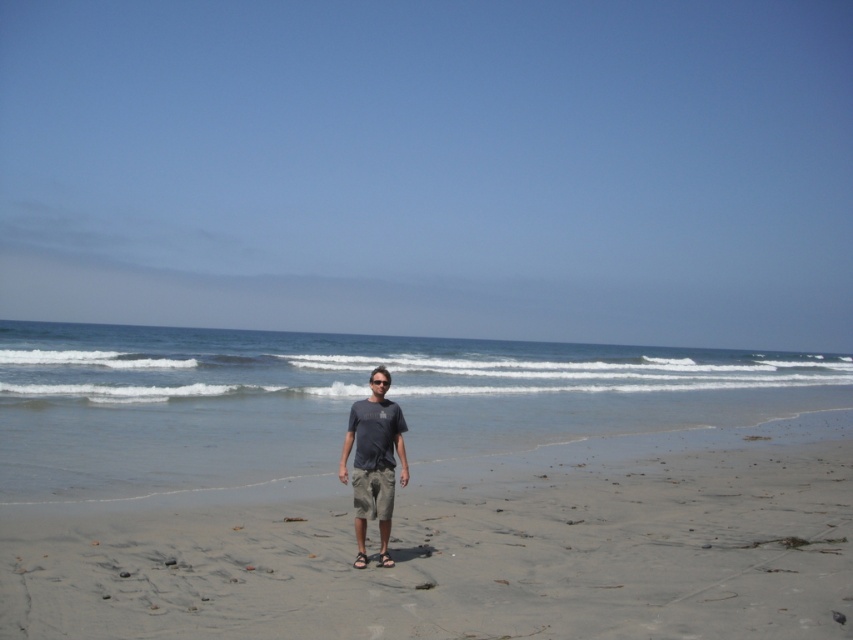
You are standing on the beach and want to place a small flag exactly at the center of the gray sand at center. According to the coordinates provided, where should you place the flag?

The gray sand at center is located at coordinates point [469,547], so you should place the flag at point [469,547].

You are a photographer trying to capture the person in the dark gray t shirt at center. The camera you are using has a laser pointer that can only target coordinates on the image. The coordinates are given as a point between 0 and 1 in both x and y axes. The photographer wants to know if the point at (374, 456) is the correct coordinate to target the dark gray t shirt at center. Is this coordinate correct?

Yes, the point at (374, 456) corresponds to the dark gray t shirt at center as stated in the objects description.